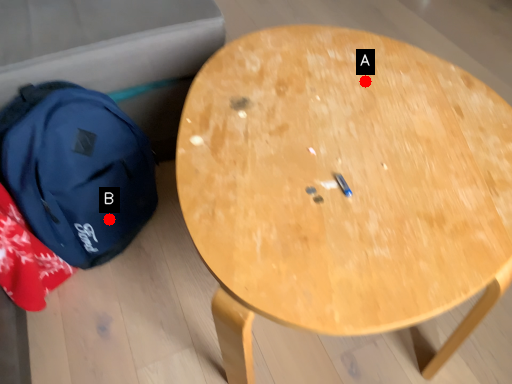
Question: Two points are circled on the image, labeled by A and B beside each circle. Among these points, which one is nearest to the camera?

Choices:
 (A) A is closer
 (B) B is closer

Answer: (A)